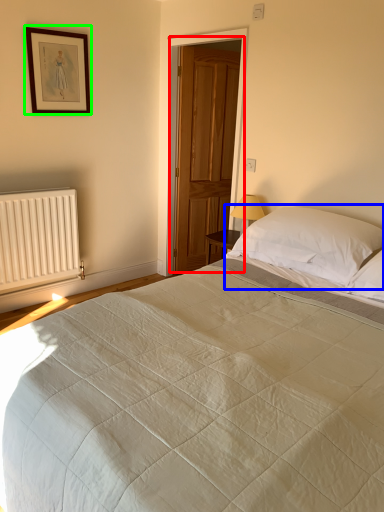
Question: Estimate the real-world distances between objects in this image. Which object is farther from door (highlighted by a red box), pillow (highlighted by a blue box) or picture frame (highlighted by a green box)?

Choices:
 (A) pillow
 (B) picture frame

Answer: (A)